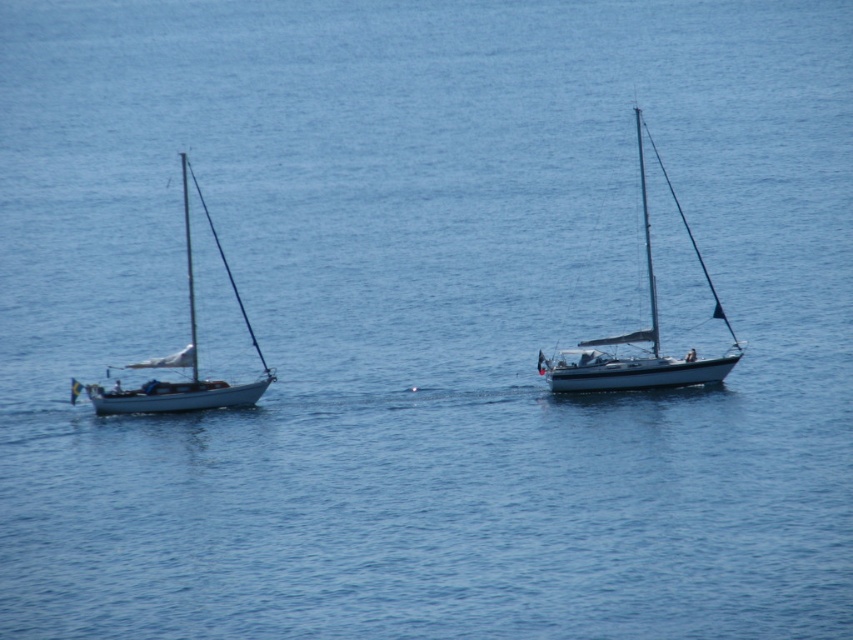
Question: Among these points, which one is nearest to the camera?

Choices:
 (A) (653, 346)
 (B) (648, 332)
 (C) (219, 384)

Answer: (B)

Question: Can you confirm if white glossy sailboat at center is smaller than white matte sailboat at left?

Choices:
 (A) no
 (B) yes

Answer: (A)

Question: Does white glossy sailboat at center have a greater width compared to white matte mast at upper center?

Choices:
 (A) no
 (B) yes

Answer: (B)

Question: Which of the following is the closest to the observer?

Choices:
 (A) white glossy sailboat at center
 (B) white matte sailboat at left
 (C) white matte mast at upper center

Answer: (A)

Question: Which object appears farthest from the camera in this image?

Choices:
 (A) white matte mast at upper center
 (B) white glossy sailboat at center
 (C) white matte sailboat at left

Answer: (A)

Question: Observing the image, what is the correct spatial positioning of white glossy sailboat at center in reference to white matte sailboat at left?

Choices:
 (A) right
 (B) left

Answer: (A)